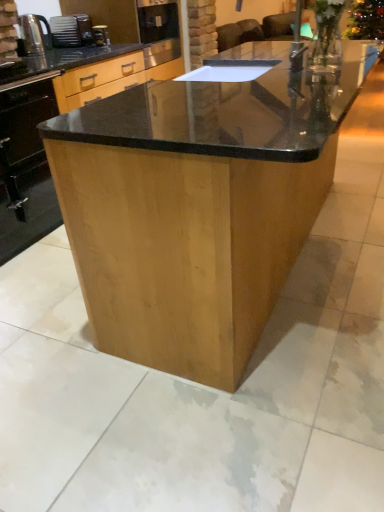
Question: From the image's perspective, is shiny brown wood table at center above or below metallic silver kettle at left?

Choices:
 (A) above
 (B) below

Answer: (B)

Question: In terms of height, does shiny brown wood table at center look taller or shorter compared to metallic silver kettle at left?

Choices:
 (A) short
 (B) tall

Answer: (B)

Question: Based on their relative distances, which object is nearer to the shiny brown wood table at center?

Choices:
 (A) black glossy oven at lower left
 (B) satin black toaster at upper left
 (C) metallic silver kettle at left
 (D) metallic silver coffee machine at upper left

Answer: (A)

Question: Based on their relative distances, which object is farther from the black glossy oven at lower left?

Choices:
 (A) metallic silver coffee machine at upper left
 (B) metallic silver kettle at left
 (C) shiny brown wood table at center
 (D) satin black toaster at upper left

Answer: (A)